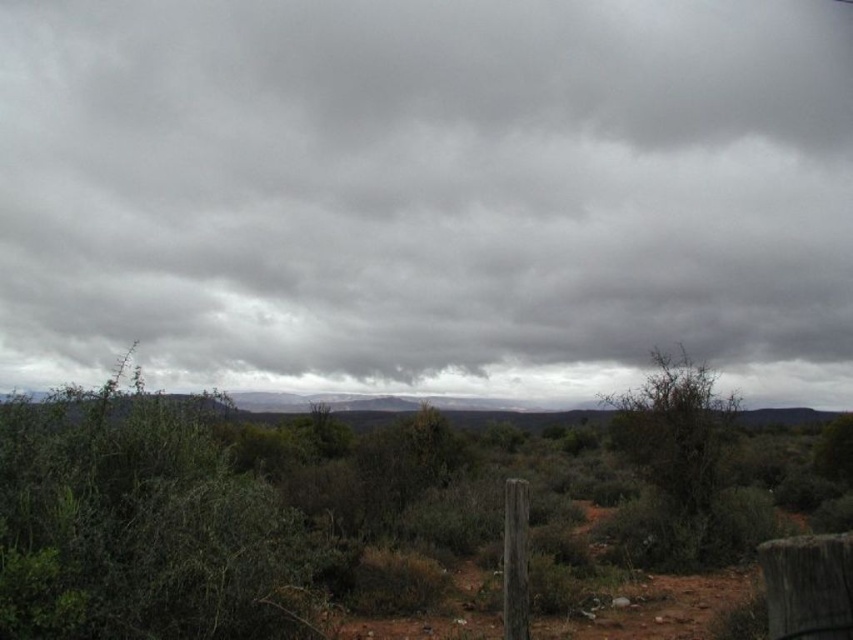
Measure the distance between gray matte cloud at upper center and green leafy bush at center.

gray matte cloud at upper center is 25.82 meters away from green leafy bush at center.

Which is in front, point (302, 282) or point (648, 380)?

Point (648, 380)

Is point (415, 339) in front of point (647, 381)?

No, (415, 339) is behind (647, 381).

Locate an element on the screen. gray matte cloud at upper center is located at coordinates (427, 195).